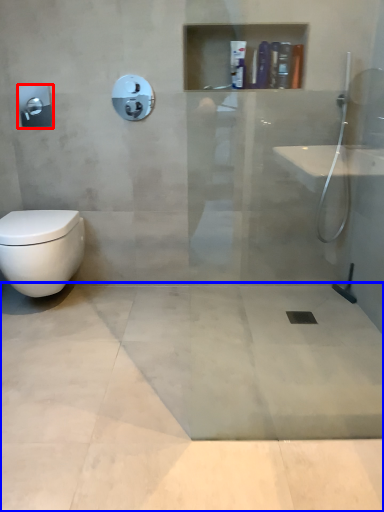
Question: Which object is further to the camera taking this photo, towel bar (highlighted by a red box) or concrete (highlighted by a blue box)?

Choices:
 (A) towel bar
 (B) concrete

Answer: (A)